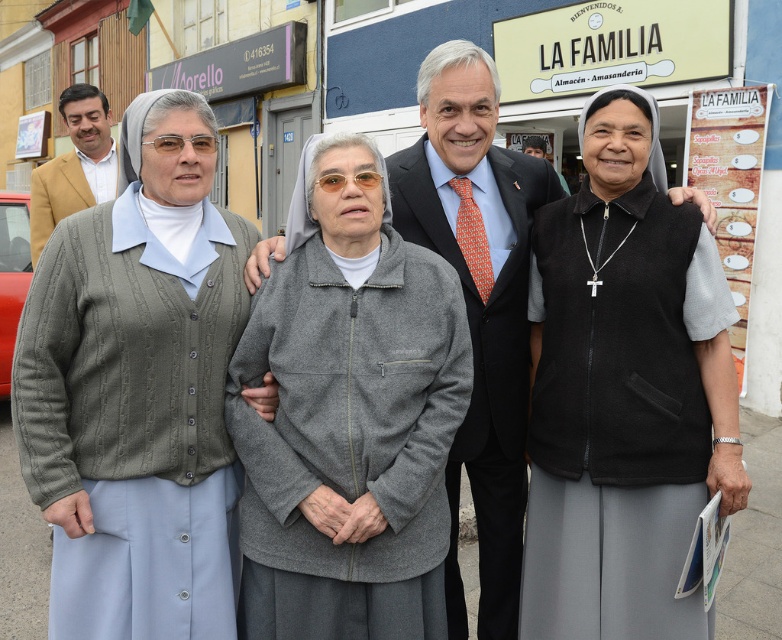
Question: Which object is the closest to the gray fleece jacket at center?

Choices:
 (A) black matte vest at center
 (B) knitted gray cardigan at center

Answer: (B)

Question: Does black matte vest at center appear on the right side of matte tan blazer at left?

Choices:
 (A) yes
 (B) no

Answer: (A)

Question: Is the position of black matte vest at center more distant than that of gray fleece jacket at center?

Choices:
 (A) no
 (B) yes

Answer: (B)

Question: Does black matte vest at center appear on the right side of gray fleece jacket at center?

Choices:
 (A) no
 (B) yes

Answer: (B)

Question: Which object is closer to the camera taking this photo?

Choices:
 (A) black matte vest at center
 (B) matte tan blazer at left

Answer: (A)

Question: Which point is farther from the camera taking this photo?

Choices:
 (A) (63, 88)
 (B) (555, 438)
 (C) (305, 388)

Answer: (A)